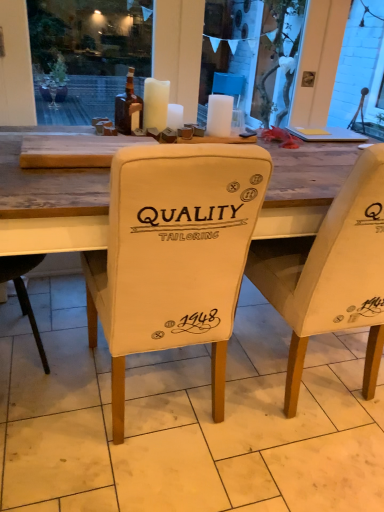
The height and width of the screenshot is (512, 384). I want to click on free spot below beige fabric chair at center, the 1th chair when ordered from right to left (from a real-world perspective), so click(304, 368).